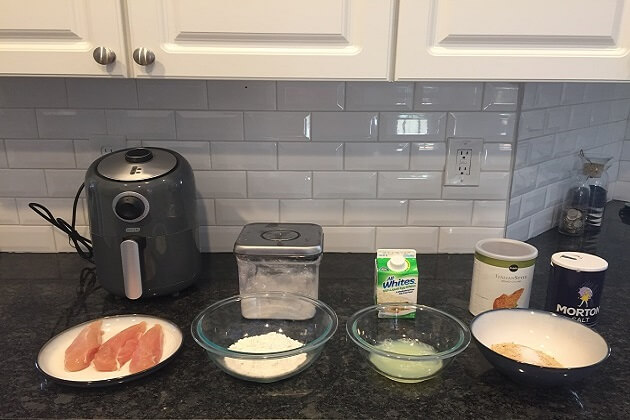
Image resolution: width=630 pixels, height=420 pixels. What are the coordinates of `white tile backsplash` in the screenshot? It's located at (392, 225).